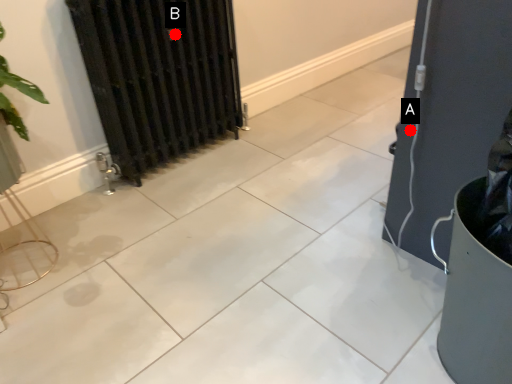
Question: Two points are circled on the image, labeled by A and B beside each circle. Which of the following is the closest to the observer?

Choices:
 (A) A is closer
 (B) B is closer

Answer: (A)